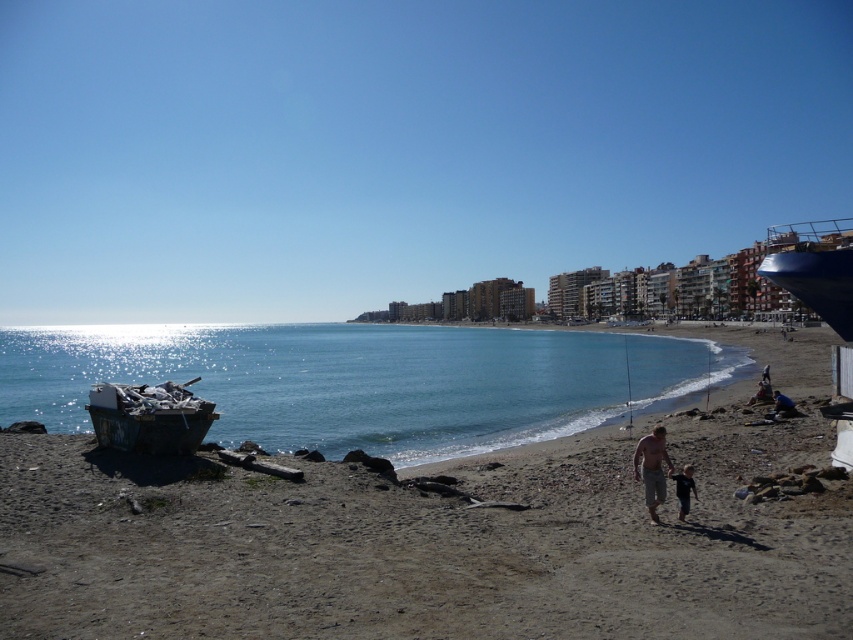
Question: Among these objects, which one is farthest from the camera?

Choices:
 (A) tan skin man at center
 (B) rusty metal boat at left
 (C) brown sand at lower left

Answer: (B)

Question: Does brown sand at lower left have a greater width compared to tan skin man at center?

Choices:
 (A) no
 (B) yes

Answer: (B)

Question: Which of the following is the farthest from the observer?

Choices:
 (A) (64, 374)
 (B) (643, 477)
 (C) (187, 436)
 (D) (544, 544)

Answer: (A)

Question: Does brown sand at lower left have a lesser width compared to rusty metal boat at left?

Choices:
 (A) no
 (B) yes

Answer: (A)

Question: Which object is farther from the camera taking this photo?

Choices:
 (A) black matte shorts at lower right
 (B) blue glossy water at center
 (C) rusty metal boat at left
 (D) brown sand at lower left

Answer: (B)

Question: Is rusty metal boat at left bigger than tan skin man at center?

Choices:
 (A) no
 (B) yes

Answer: (A)